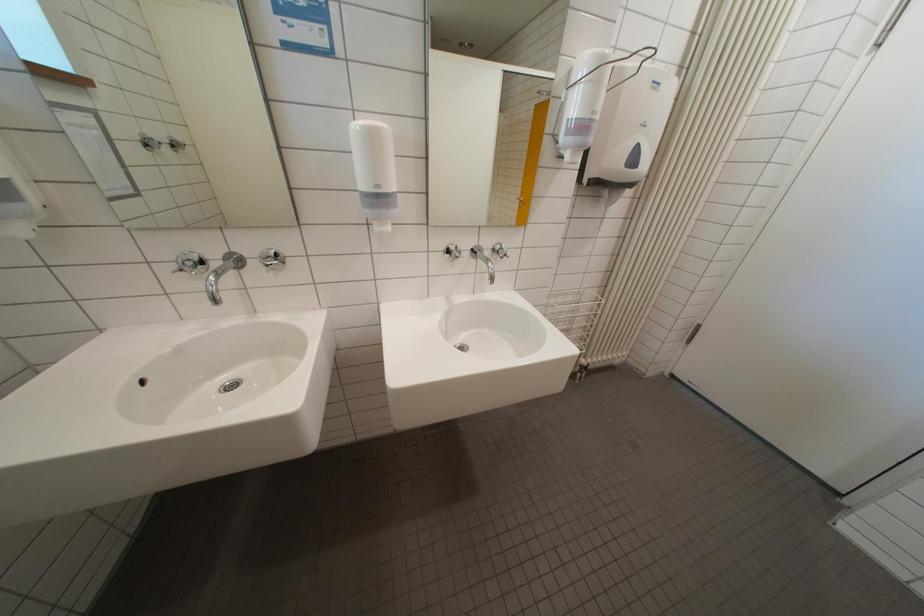
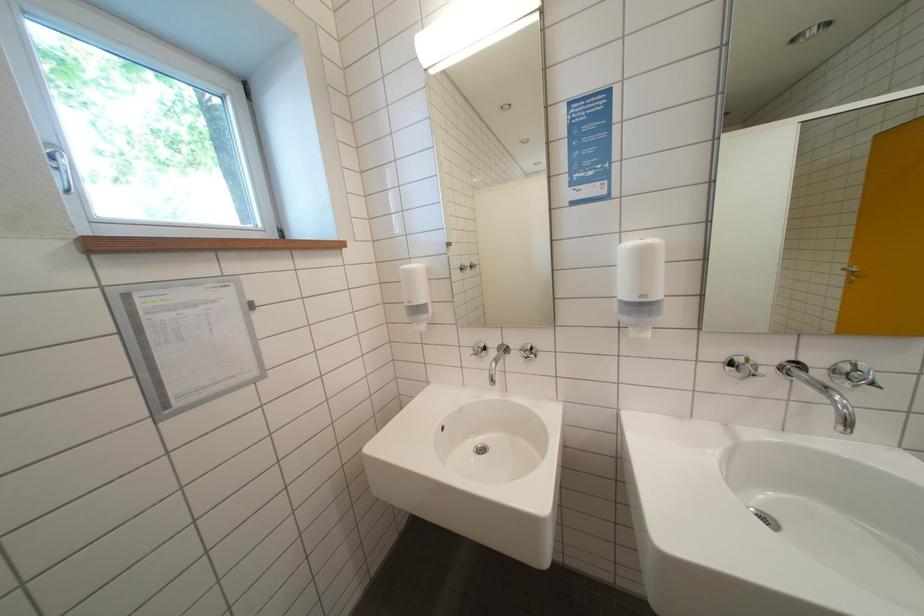
Question: Based on the continuous images, in which direction is the camera rotating? Reply with the corresponding letter.

Choices:
 (A) Left
 (B) Right
 (C) Up
 (D) Down

Answer: (A)